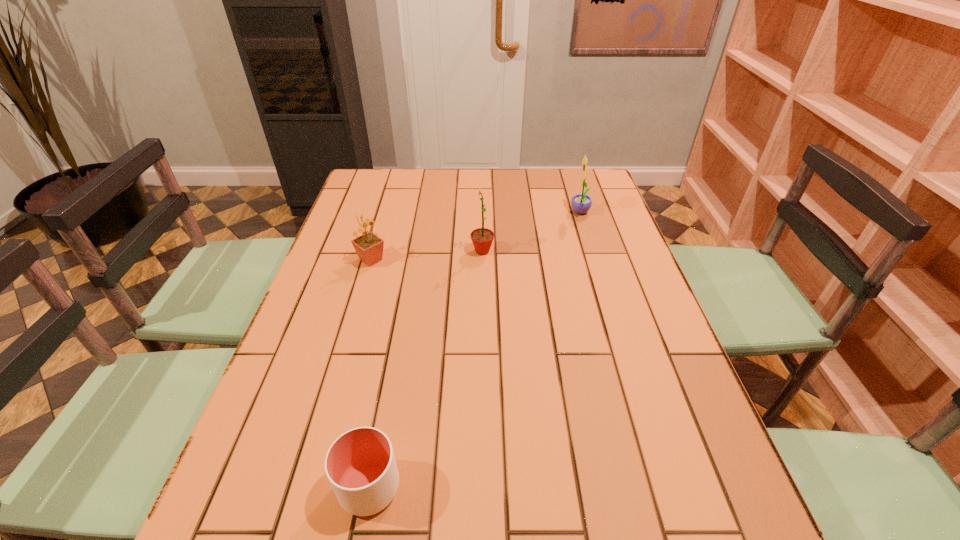
The width and height of the screenshot is (960, 540). I want to click on the second sunflower from left to right, so click(x=482, y=238).

At what (x,y) coordinates should I click in order to perform the action: click on the rightmost sunflower. Please return your answer as a coordinate pair (x, y). The height and width of the screenshot is (540, 960). Looking at the image, I should click on (581, 203).

Where is `the farthest object`? This screenshot has width=960, height=540. the farthest object is located at coordinates (581, 203).

The width and height of the screenshot is (960, 540). I want to click on the leftmost sunflower, so click(x=369, y=247).

Locate an element on the screen. This screenshot has height=540, width=960. the third tallest object is located at coordinates (369, 247).

Identify the location of the third object from right to left. click(360, 465).

The height and width of the screenshot is (540, 960). I want to click on the shortest object, so click(360, 465).

Where is `vacant space located on the face of the second object from right to left`? Image resolution: width=960 pixels, height=540 pixels. vacant space located on the face of the second object from right to left is located at coordinates (410, 251).

You are a GUI agent. You are given a task and a screenshot of the screen. Output one action in this format:
    pyautogui.click(x=<x>, y=<y>)
    Task: Click on the vacant space located 0.320m on the face of the second object from right to left
    The width and height of the screenshot is (960, 540).
    Given the screenshot: What is the action you would take?
    pyautogui.click(x=362, y=251)

You are a GUI agent. You are given a task and a screenshot of the screen. Output one action in this format:
    pyautogui.click(x=<x>, y=<y>)
    Task: Click on the free space located 0.090m on the face of the second object from right to left
    The width and height of the screenshot is (960, 540).
    Given the screenshot: What is the action you would take?
    pyautogui.click(x=440, y=251)